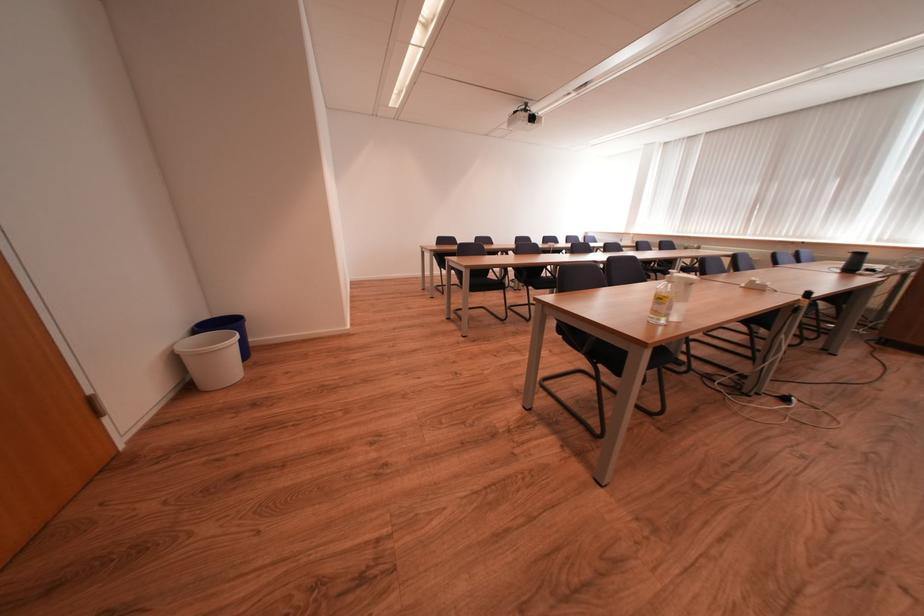
Identify the location of white trash can. (211, 359).